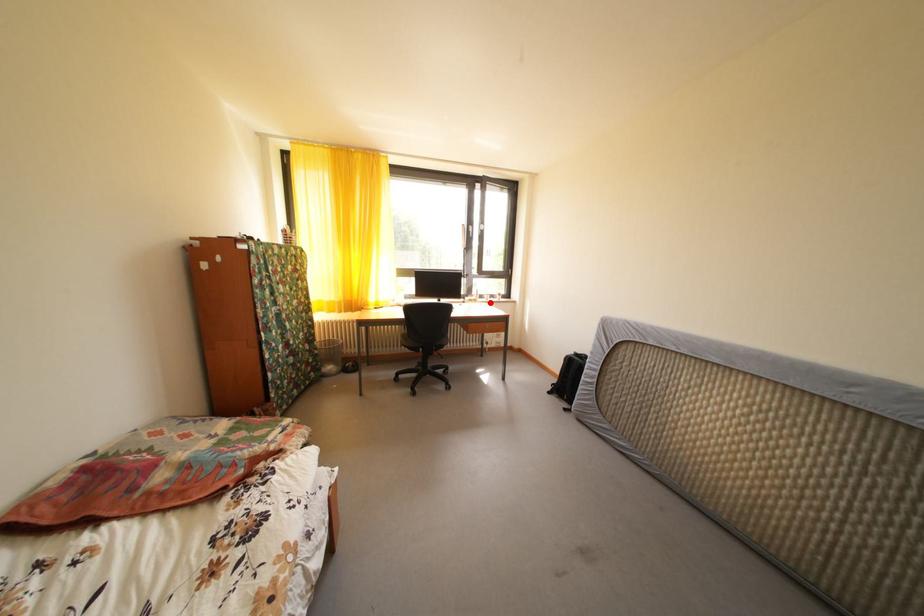
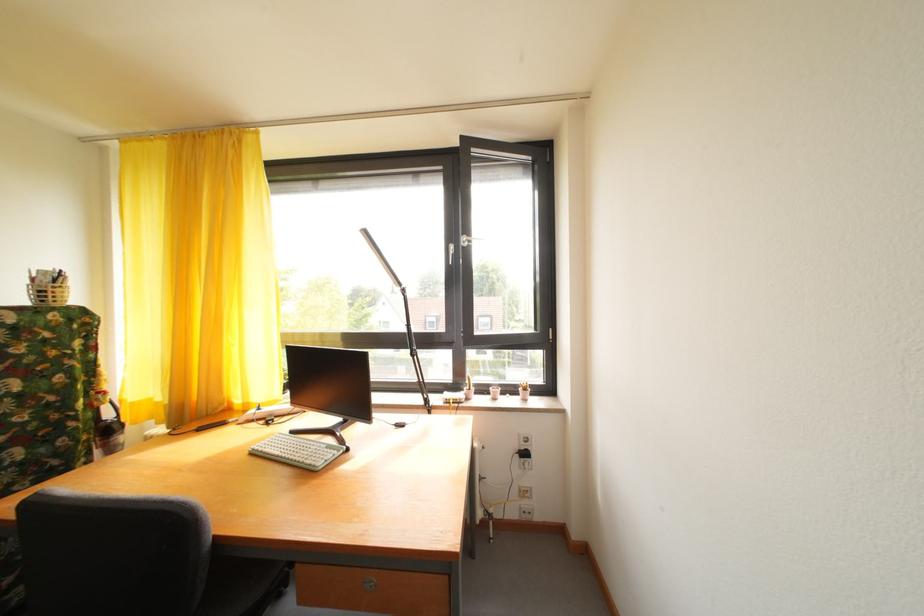
Where in the second image is the point corresponding to the highlighted location from the first image?

(492, 395)